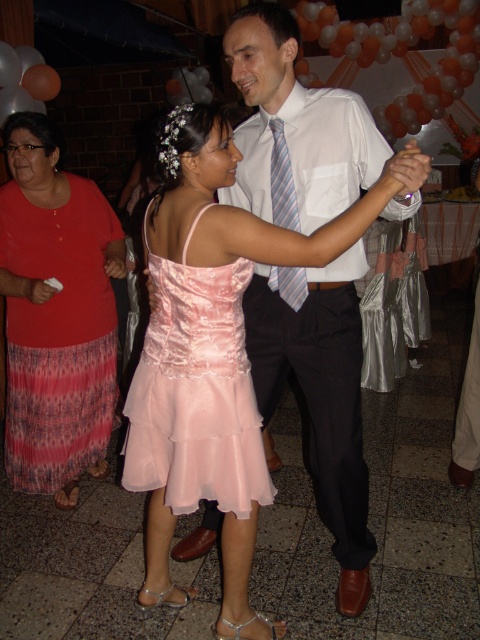
Does white shirt at center appear under pink satin dress at center?

No, white shirt at center is not below pink satin dress at center.

Is white shirt at center bigger than pink satin dress at center?

Indeed, white shirt at center has a larger size compared to pink satin dress at center.

The height and width of the screenshot is (640, 480). Identify the location of white shirt at center. (320, 394).

Does white shirt at center have a smaller size compared to striped fabric tie at center?

No.

Which is below, white shirt at center or striped fabric tie at center?

Positioned lower is white shirt at center.

Which is in front, point (407, 161) or point (276, 154)?

Positioned in front is point (407, 161).

The width and height of the screenshot is (480, 640). What are the coordinates of `white shirt at center` in the screenshot? It's located at (320, 394).

Can you confirm if pink pleated skirt at lower left is positioned to the left of striped fabric tie at center?

Correct, you'll find pink pleated skirt at lower left to the left of striped fabric tie at center.

Which is above, pink pleated skirt at lower left or striped fabric tie at center?

striped fabric tie at center is above.

The width and height of the screenshot is (480, 640). I want to click on pink pleated skirt at lower left, so click(x=56, y=314).